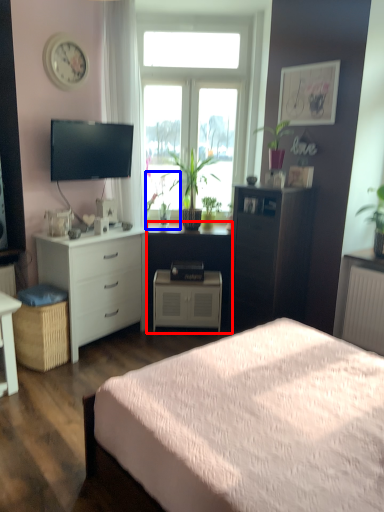
Question: Which object is closer to the camera taking this photo, computer desk (highlighted by a red box) or houseplant (highlighted by a blue box)?

Choices:
 (A) computer desk
 (B) houseplant

Answer: (B)